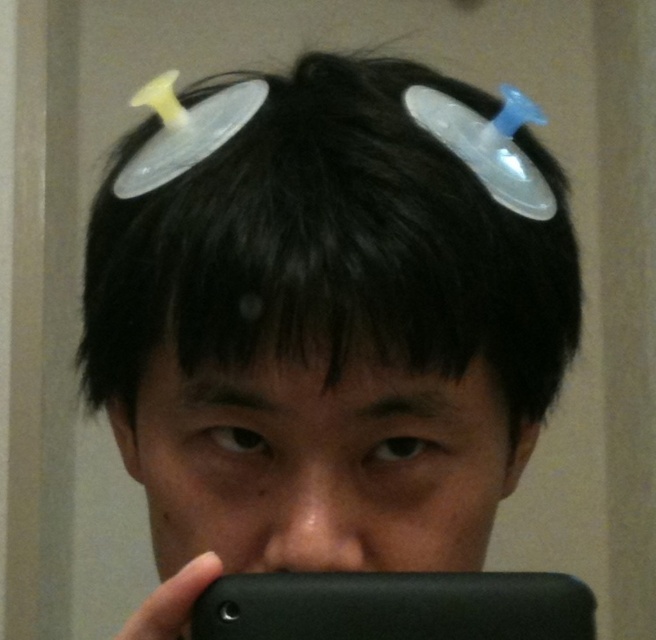
Does black matte hair at upper center have a smaller size compared to black matte smartphone at lower center?

Actually, black matte hair at upper center might be larger than black matte smartphone at lower center.

Is black matte hair at upper center positioned at the back of black matte smartphone at lower center?

No, black matte hair at upper center is in front of black matte smartphone at lower center.

Does point (361, 241) come in front of point (249, 630)?

Yes, point (361, 241) is in front of point (249, 630).

The height and width of the screenshot is (640, 656). I want to click on black matte hair at upper center, so click(x=331, y=248).